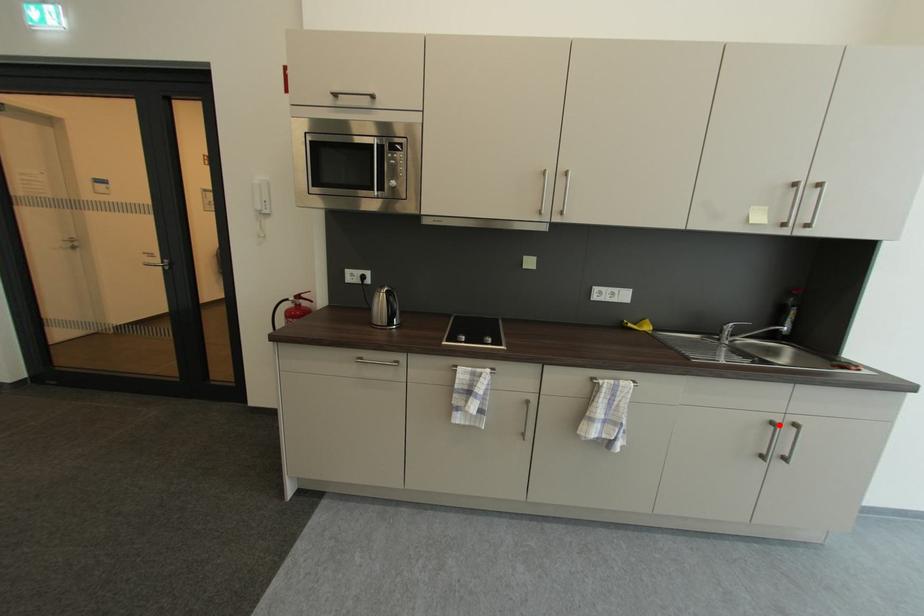
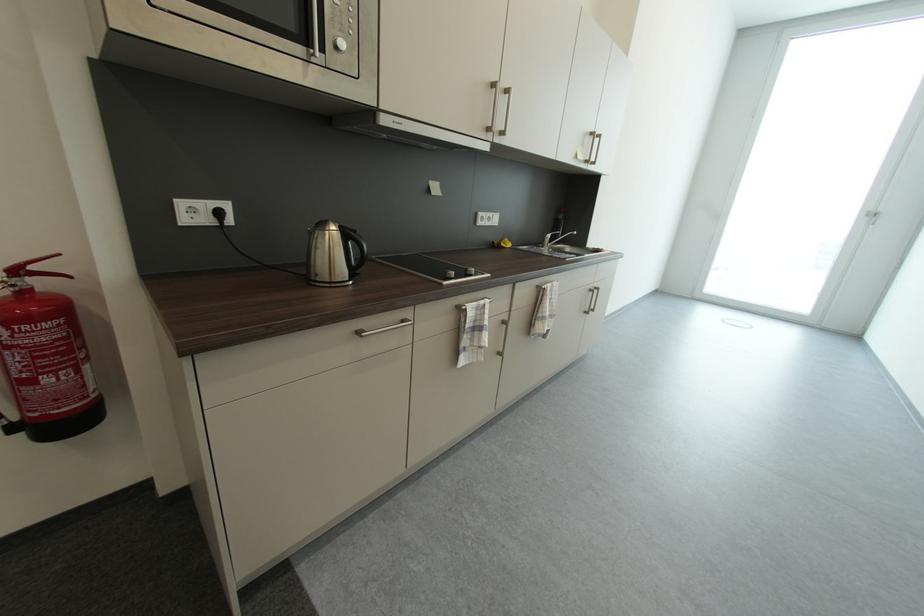
Where in the second image is the point corresponding to the highlighted location from the first image?

(598, 292)